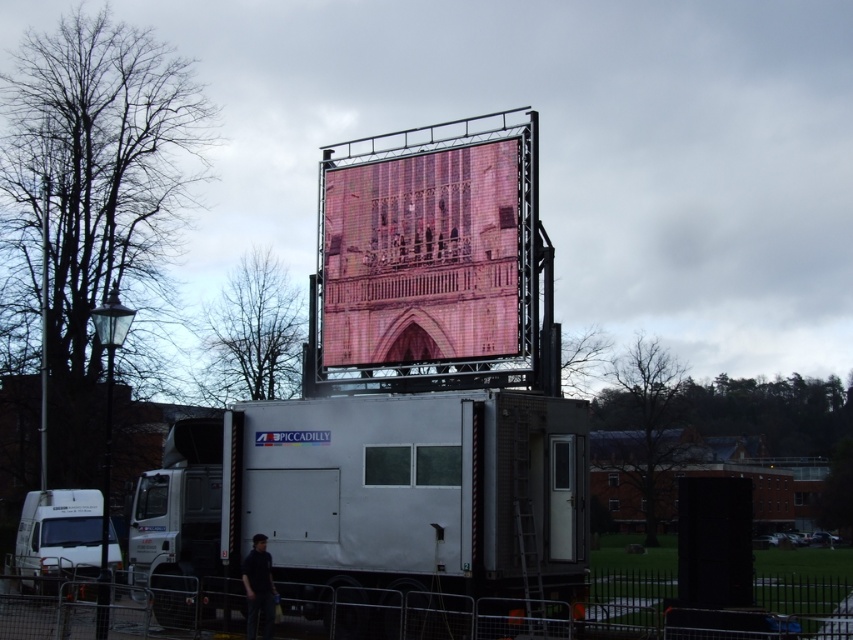
Question: Considering the relative positions of pink pixelated screen at center and white matte truck at lower left in the image provided, where is pink pixelated screen at center located with respect to white matte truck at lower left?

Choices:
 (A) right
 (B) left

Answer: (A)

Question: Which point appears closest to the camera in this image?

Choices:
 (A) (477, 268)
 (B) (18, 561)
 (C) (518, 390)
 (D) (258, 605)

Answer: (D)

Question: Does white matte truck at center appear over dark blue shirt at lower left?

Choices:
 (A) yes
 (B) no

Answer: (A)

Question: Considering the real-world distances, which object is closest to the dark blue shirt at lower left?

Choices:
 (A) white matte truck at center
 (B) pink pixelated screen at center
 (C) white matte truck at lower left

Answer: (A)

Question: Can you confirm if white matte truck at center is thinner than dark blue shirt at lower left?

Choices:
 (A) no
 (B) yes

Answer: (A)

Question: Which point appears farthest from the camera in this image?

Choices:
 (A) (404, 177)
 (B) (106, 548)

Answer: (A)